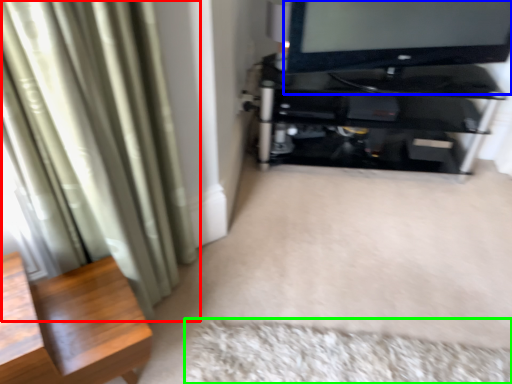
Question: Based on their relative distances, which object is nearer to curtain (highlighted by a red box)? Choose from television (highlighted by a blue box) and mat (highlighted by a green box).

Choices:
 (A) television
 (B) mat

Answer: (B)